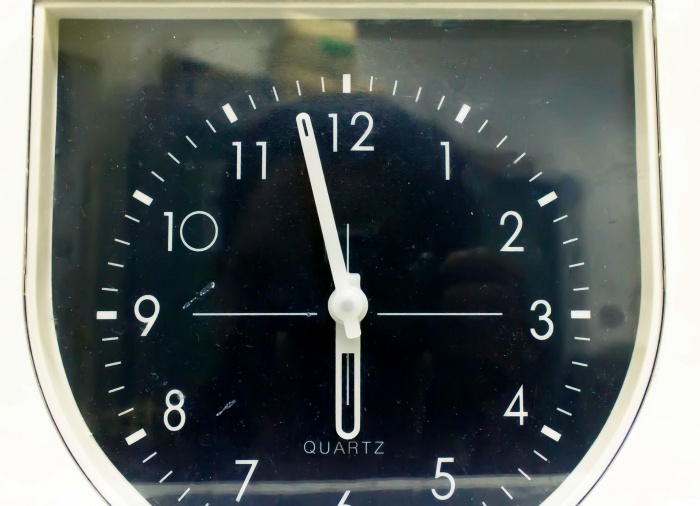
Identify the location of clock. (363, 49).